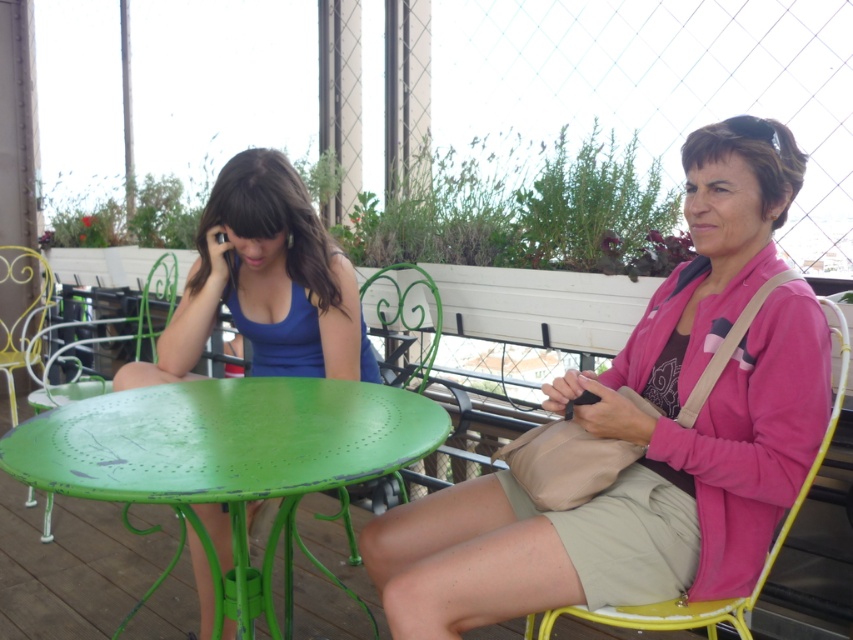
You are planning to place a large potted plant between the green painted metal table at center and the yellow metal chair at right. Based on their positions, which object should the plant be closer to?

The green painted metal table at center is positioned on the left side of yellow metal chair at right, so the plant should be placed closer to the yellow metal chair at right since the table is to its left.

In the scene shown: You are trying to decide whether to place a new decorative item between the pink fabric jacket at upper right and the green painted metal table at center. Considering their sizes, which object should you place the item closer to for balance?

The pink fabric jacket at upper right has a smaller size compared to the green painted metal table at center, so placing the decorative item closer to the larger green painted metal table at center would help balance the arrangement.